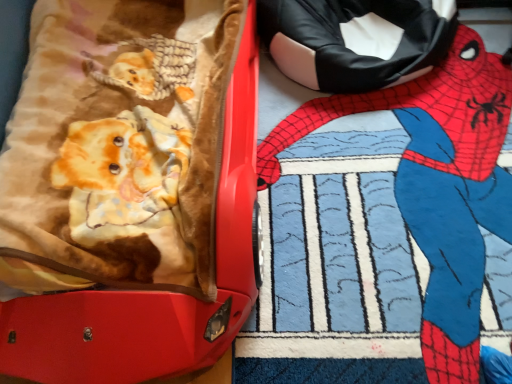
Question: From a real-world perspective, does spider-man costume at upper right sit lower than matte red suitcase at left?

Choices:
 (A) no
 (B) yes

Answer: (B)

Question: Considering the relative sizes of spider-man costume at upper right and matte red suitcase at left in the image provided, is spider-man costume at upper right wider than matte red suitcase at left?

Choices:
 (A) yes
 (B) no

Answer: (B)

Question: From the image's perspective, would you say spider-man costume at upper right is shown under matte red suitcase at left?

Choices:
 (A) no
 (B) yes

Answer: (B)

Question: Is spider-man costume at upper right further to the viewer compared to matte red suitcase at left?

Choices:
 (A) yes
 (B) no

Answer: (A)

Question: Does spider-man costume at upper right have a larger size compared to matte red suitcase at left?

Choices:
 (A) yes
 (B) no

Answer: (B)

Question: Can you see spider-man costume at upper right touching matte red suitcase at left?

Choices:
 (A) no
 (B) yes

Answer: (A)

Question: Does matte red suitcase at left have a lesser height compared to spider-man costume at upper right?

Choices:
 (A) yes
 (B) no

Answer: (B)

Question: Does matte red suitcase at left have a lesser width compared to spider-man costume at upper right?

Choices:
 (A) yes
 (B) no

Answer: (B)

Question: From the image's perspective, is matte red suitcase at left located beneath spider-man costume at upper right?

Choices:
 (A) yes
 (B) no

Answer: (B)

Question: Is there a large distance between matte red suitcase at left and spider-man costume at upper right?

Choices:
 (A) yes
 (B) no

Answer: (B)

Question: Is matte red suitcase at left in contact with spider-man costume at upper right?

Choices:
 (A) no
 (B) yes

Answer: (A)

Question: Is matte red suitcase at left at the left side of spider-man costume at upper right?

Choices:
 (A) yes
 (B) no

Answer: (A)

Question: Considering the positions of spider-man costume at upper right and matte red suitcase at left in the image, is spider-man costume at upper right wider or thinner than matte red suitcase at left?

Choices:
 (A) thin
 (B) wide

Answer: (A)